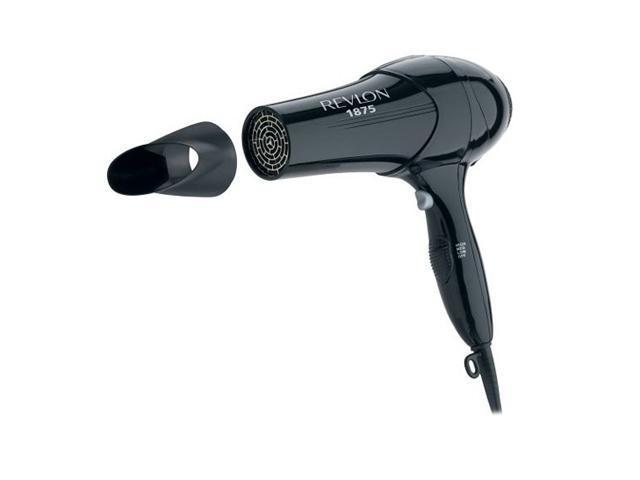
The image size is (640, 480). In order to click on on off switch in this screenshot , I will do `click(420, 203)`.